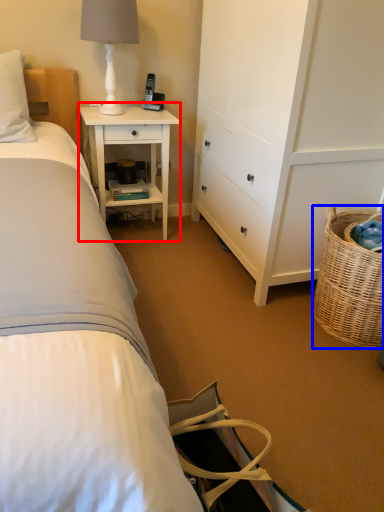
Question: Which of the following is the closest to the observer, nightstand (highlighted by a red box) or picnic basket (highlighted by a blue box)?

Choices:
 (A) nightstand
 (B) picnic basket

Answer: (B)